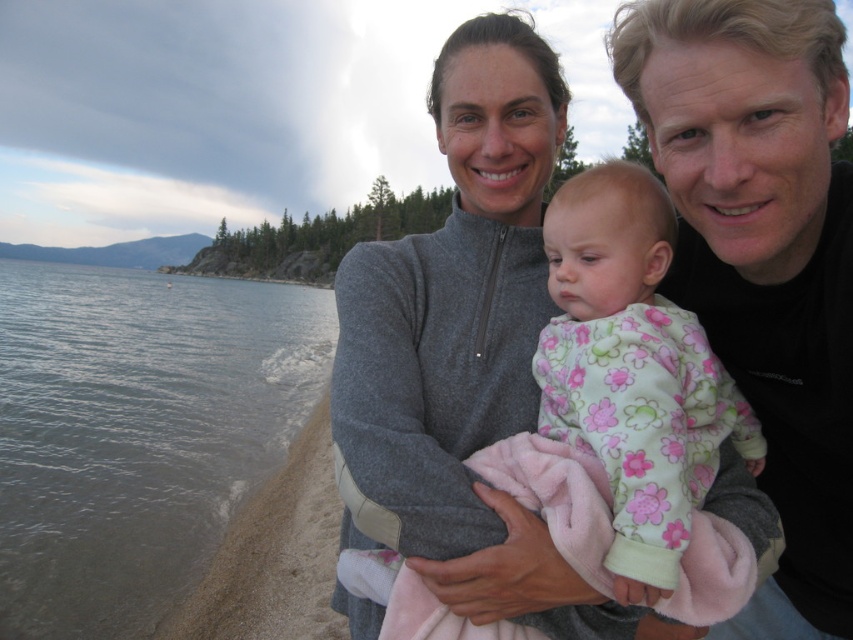
You are standing at the center of the sandy beach in the family photo. There is a gray water at lower left marked by point (137, 433). If you want to reach the water as quickly as possible, which direction should you head towards?

You should head towards the lower left direction to reach the gray water at lower left marked by point (137, 433) as quickly as possible.